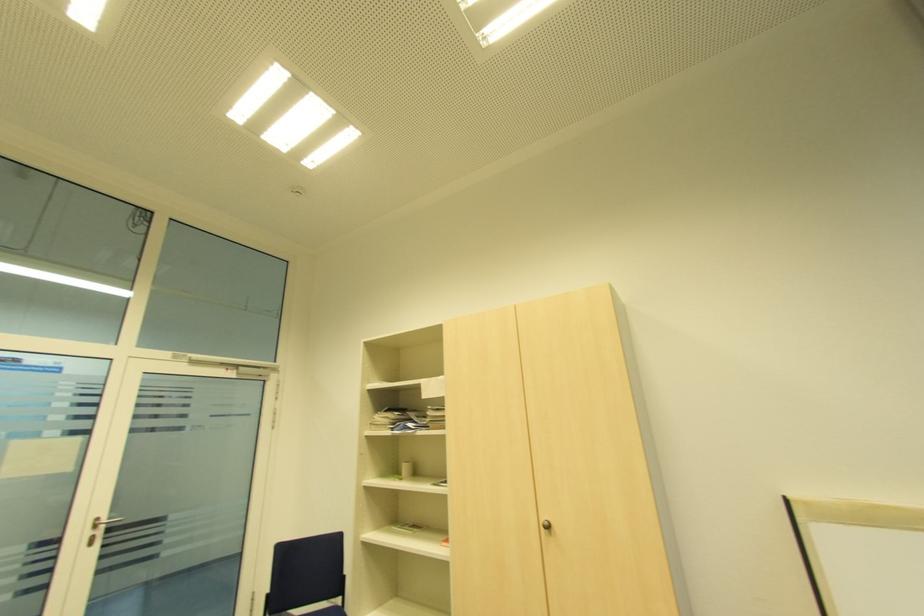
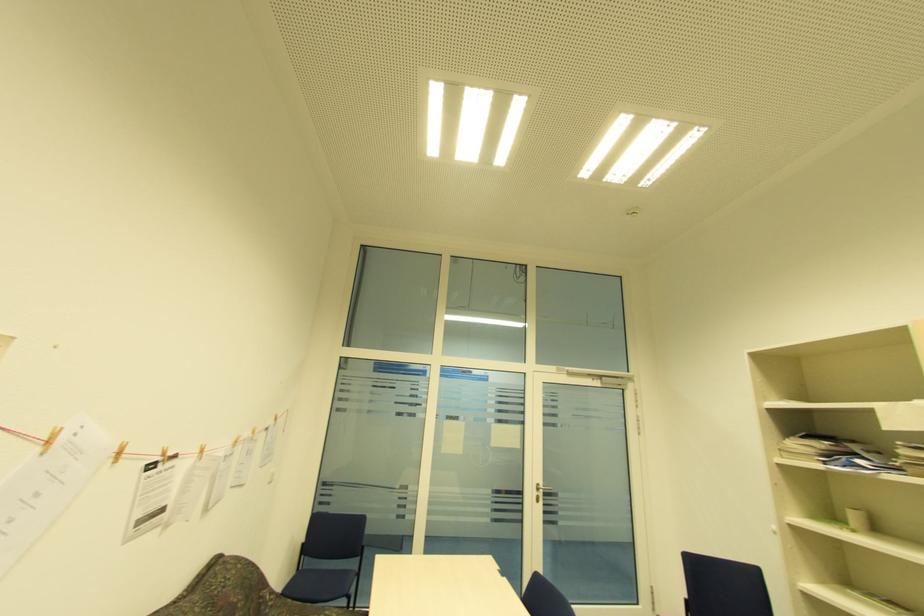
Locate, in the second image, the point that corresponds to pixel 90 533 in the first image.

(538, 493)